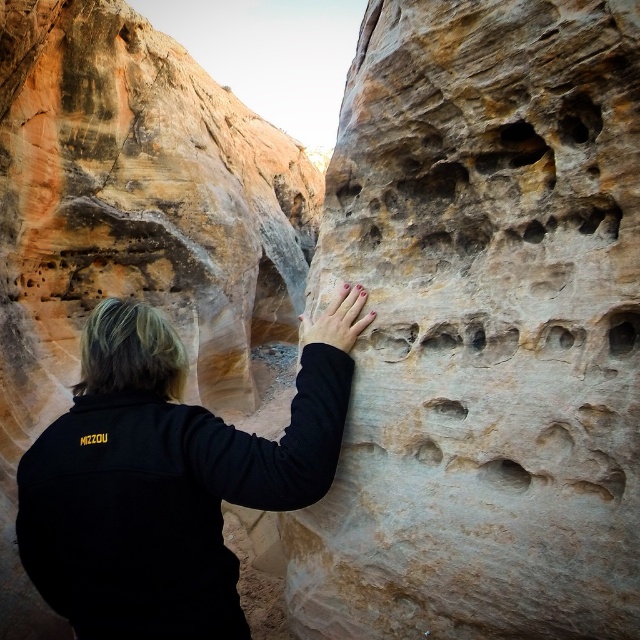
Question: Does smooth beige rock at center have a greater width compared to black fleece jacket at center?

Choices:
 (A) yes
 (B) no

Answer: (A)

Question: Based on their relative distances, which object is nearer to the rustic stone handhold at center?

Choices:
 (A) black fleece jacket at center
 (B) smooth beige rock at center

Answer: (A)

Question: Can you confirm if smooth beige rock at center is positioned above black fleece jacket at center?

Choices:
 (A) no
 (B) yes

Answer: (B)

Question: Does rustic stone handhold at center appear on the right side of black fleece jacket at center?

Choices:
 (A) no
 (B) yes

Answer: (B)

Question: Which of these objects is positioned farthest from the black fleece jacket at center?

Choices:
 (A) rustic stone handhold at center
 (B) smooth beige rock at center

Answer: (B)

Question: Which object is farther from the camera taking this photo?

Choices:
 (A) smooth beige rock at center
 (B) black fleece jacket at center

Answer: (A)